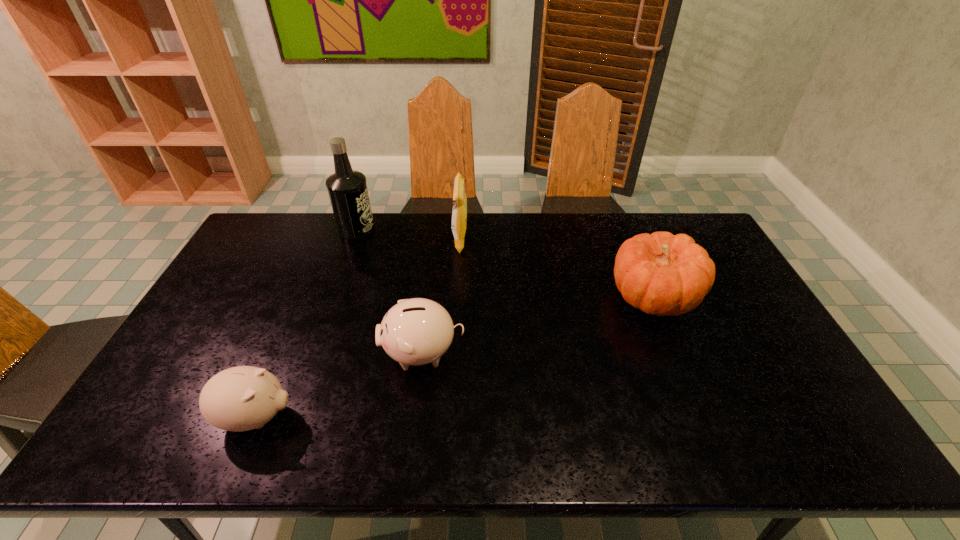
Point out which object is positioned as the fourth nearest to the nearest object. Please provide its 2D coordinates. Your answer should be formatted as a tuple, i.e. [(x, y)], where the tuple contains the x and y coordinates of a point satisfying the conditions above.

[(662, 274)]

What are the coordinates of `object that is the closest to the tallest object` in the screenshot? It's located at (459, 213).

What are the coordinates of `free space that satisfies the following two spatial constraints: 1. on the front of the rightmost object with the logo; 2. on the right side of the fourth shortest object` in the screenshot? It's located at [457, 296].

In order to click on free spot that satisfies the following two spatial constraints: 1. on the front of the pumpkin with the logo; 2. on the left side of the crisp (potato chip) in this screenshot , I will do `click(457, 296)`.

Where is `vacant space that satisfies the following two spatial constraints: 1. on the front label of the tallest object; 2. on the back side of the rightmost object`? vacant space that satisfies the following two spatial constraints: 1. on the front label of the tallest object; 2. on the back side of the rightmost object is located at coordinates (333, 296).

Where is `free space in the image that satisfies the following two spatial constraints: 1. on the back side of the rightmost object; 2. on the front label of the liquor`? This screenshot has height=540, width=960. free space in the image that satisfies the following two spatial constraints: 1. on the back side of the rightmost object; 2. on the front label of the liquor is located at coordinates (625, 230).

Locate an element on the screen. The height and width of the screenshot is (540, 960). vacant space that satisfies the following two spatial constraints: 1. on the front side of the farther piggy bank; 2. at the snout of the left piggy bank is located at coordinates (415, 417).

Locate an element on the screen. The image size is (960, 540). vacant area that satisfies the following two spatial constraints: 1. on the front label of the farther piggy bank; 2. on the right side of the tallest object is located at coordinates (313, 353).

What are the coordinates of `vacant space that satisfies the following two spatial constraints: 1. on the back side of the farther piggy bank; 2. on the right side of the rightmost object` in the screenshot? It's located at (430, 296).

This screenshot has width=960, height=540. In order to click on free space that satisfies the following two spatial constraints: 1. on the front label of the rightmost object; 2. on the left side of the liquor in this screenshot , I will do `click(333, 296)`.